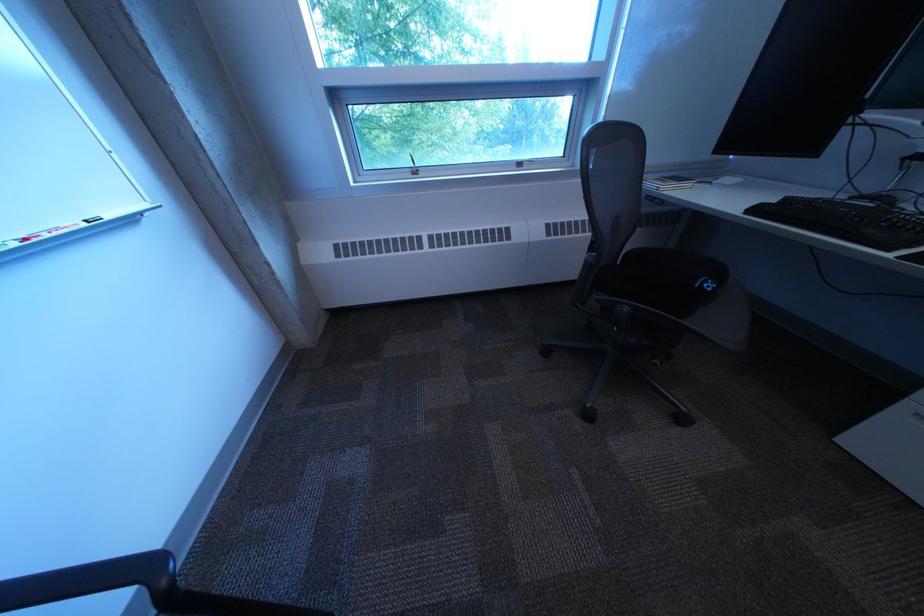
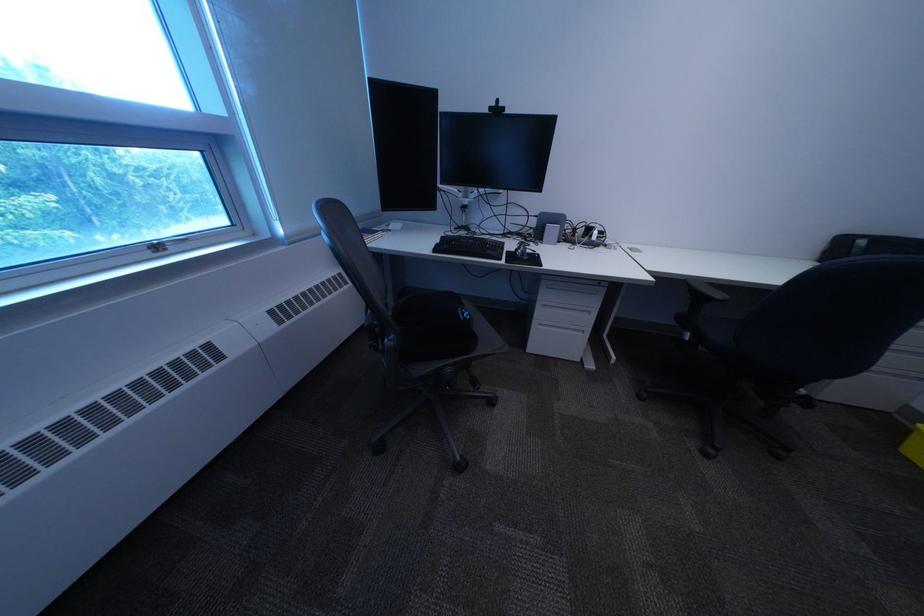
Locate, in the second image, the point that corresponds to point (531, 166) in the first image.

(164, 251)